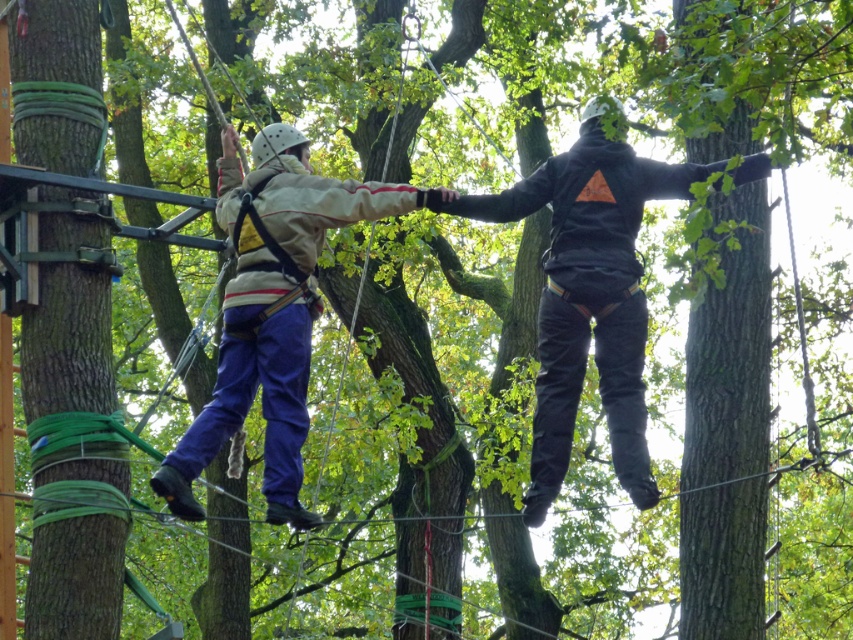
Question: Which of the following is the farthest from the observer?

Choices:
 (A) matte beige jacket at center
 (B) black matte hoodie at center

Answer: (B)

Question: Does black matte hoodie at center come in front of matte beige jacket at center?

Choices:
 (A) yes
 (B) no

Answer: (B)

Question: Is black matte hoodie at center closer to camera compared to matte beige jacket at center?

Choices:
 (A) yes
 (B) no

Answer: (B)

Question: Is black matte hoodie at center smaller than matte beige jacket at center?

Choices:
 (A) yes
 (B) no

Answer: (A)